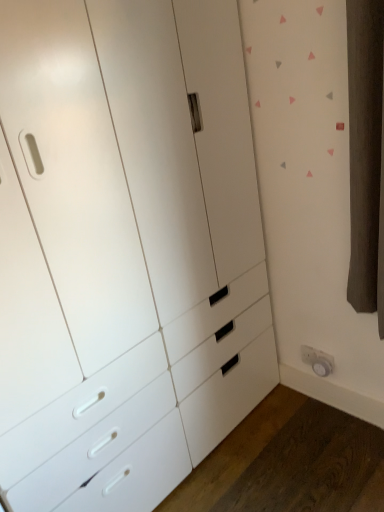
Locate an element on the screen. white plastic electric outlet at lower right is located at coordinates (318, 360).

What do you see at coordinates (318, 360) in the screenshot? I see `white plastic electric outlet at lower right` at bounding box center [318, 360].

Locate an element on the screen. This screenshot has height=512, width=384. white matte chest of drawers at center is located at coordinates (125, 249).

What do you see at coordinates (125, 249) in the screenshot? The width and height of the screenshot is (384, 512). I see `white matte chest of drawers at center` at bounding box center [125, 249].

Identify the location of white plastic electric outlet at lower right. (318, 360).

Between white matte chest of drawers at center and white plastic electric outlet at lower right, which one appears on the left side from the viewer's perspective?

white matte chest of drawers at center is more to the left.

Considering the positions of objects white matte chest of drawers at center and white plastic electric outlet at lower right in the image provided, who is in front, white matte chest of drawers at center or white plastic electric outlet at lower right?

white matte chest of drawers at center is closer to the camera.

Does point (84, 65) appear closer or farther from the camera than point (315, 358)?

Point (84, 65).

From the image's perspective, which is below, white matte chest of drawers at center or white plastic electric outlet at lower right?

white plastic electric outlet at lower right, from the image's perspective.

From a real-world perspective, between white matte chest of drawers at center and white plastic electric outlet at lower right, who is vertically higher?

From a 3D spatial view, white matte chest of drawers at center is above.

Between white matte chest of drawers at center and white plastic electric outlet at lower right, which one has smaller width?

white plastic electric outlet at lower right.

Can you confirm if white matte chest of drawers at center is taller than white plastic electric outlet at lower right?

Indeed, white matte chest of drawers at center has a greater height compared to white plastic electric outlet at lower right.

Looking at this image, is white matte chest of drawers at center bigger than white plastic electric outlet at lower right?

Indeed, white matte chest of drawers at center has a larger size compared to white plastic electric outlet at lower right.

Based on the photo, is white matte chest of drawers at center positioned beyond the bounds of white plastic electric outlet at lower right?

That's correct, white matte chest of drawers at center is outside of white plastic electric outlet at lower right.

Is white matte chest of drawers at center not close to white plastic electric outlet at lower right?

No, white matte chest of drawers at center is not far from white plastic electric outlet at lower right.

Is white plastic electric outlet at lower right at the back of white matte chest of drawers at center?

white matte chest of drawers at center is not turned away from white plastic electric outlet at lower right.

How many degrees apart are the facing directions of white matte chest of drawers at center and white plastic electric outlet at lower right?

The angular difference between white matte chest of drawers at center and white plastic electric outlet at lower right is 90.6 degrees.

Find the location of a particular element. the chest of drawers above the white plastic electric outlet at lower right (from the image's perspective) is located at coordinates (125, 249).

Does white plastic electric outlet at lower right appear on the right side of white matte chest of drawers at center?

Yes.

Which object is closer to the camera, white plastic electric outlet at lower right or white matte chest of drawers at center?

Positioned in front is white matte chest of drawers at center.

Is point (308, 346) closer to viewer compared to point (98, 381)?

No, (308, 346) is behind (98, 381).

Consider the image. From the image's perspective, would you say white plastic electric outlet at lower right is shown under white matte chest of drawers at center?

Yes, from the image's perspective, white plastic electric outlet at lower right is beneath white matte chest of drawers at center.

From a real-world perspective, is white plastic electric outlet at lower right positioned under white matte chest of drawers at center based on gravity?

Yes, from a real-world perspective, white plastic electric outlet at lower right is below white matte chest of drawers at center.

Between white plastic electric outlet at lower right and white matte chest of drawers at center, which one has smaller width?

With smaller width is white plastic electric outlet at lower right.

Considering the sizes of objects white plastic electric outlet at lower right and white matte chest of drawers at center in the image provided, who is shorter, white plastic electric outlet at lower right or white matte chest of drawers at center?

With less height is white plastic electric outlet at lower right.

Is white plastic electric outlet at lower right bigger than white matte chest of drawers at center?

No, white plastic electric outlet at lower right is not bigger than white matte chest of drawers at center.

Is white plastic electric outlet at lower right positioned beyond the bounds of white matte chest of drawers at center?

white plastic electric outlet at lower right is positioned outside white matte chest of drawers at center.

Would you consider white plastic electric outlet at lower right to be distant from white matte chest of drawers at center?

No, there isn't a large distance between white plastic electric outlet at lower right and white matte chest of drawers at center.

Is white plastic electric outlet at lower right oriented towards white matte chest of drawers at center?

No, white plastic electric outlet at lower right is not turned towards white matte chest of drawers at center.

You are a GUI agent. You are given a task and a screenshot of the screen. Output one action in this format:
    pyautogui.click(x=<x>, y=<y>)
    Task: Click on the chest of drawers located on the left of white plastic electric outlet at lower right
    
    Given the screenshot: What is the action you would take?
    pyautogui.click(x=125, y=249)

You are a GUI agent. You are given a task and a screenshot of the screen. Output one action in this format:
    pyautogui.click(x=<x>, y=<y>)
    Task: Click on the electric outlet located below the white matte chest of drawers at center (from the image's perspective)
    Image resolution: width=384 pixels, height=512 pixels.
    Given the screenshot: What is the action you would take?
    pyautogui.click(x=318, y=360)

You are a GUI agent. You are given a task and a screenshot of the screen. Output one action in this format:
    pyautogui.click(x=<x>, y=<y>)
    Task: Click on the electric outlet below the white matte chest of drawers at center (from a real-world perspective)
    The height and width of the screenshot is (512, 384).
    Given the screenshot: What is the action you would take?
    pyautogui.click(x=318, y=360)